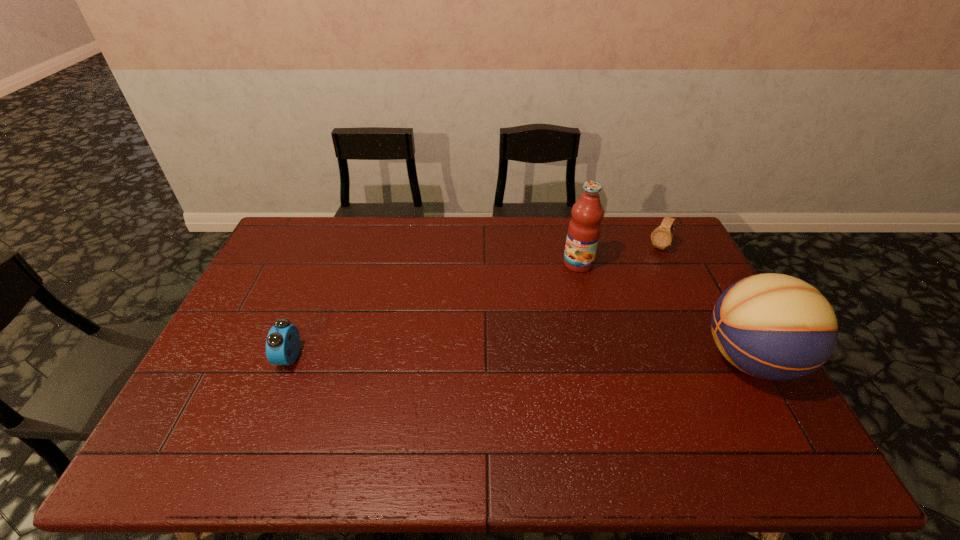
Image resolution: width=960 pixels, height=540 pixels. Identify the location of free spot that satisfies the following two spatial constraints: 1. on the front side of the fruit juice; 2. on the patterned surface of the basketball. (602, 359).

At what (x,y) coordinates should I click in order to perform the action: click on vacant point that satisfies the following two spatial constraints: 1. on the front side of the fruit juice; 2. on the patterned surface of the basketball. Please return your answer as a coordinate pair (x, y). Looking at the image, I should click on (602, 359).